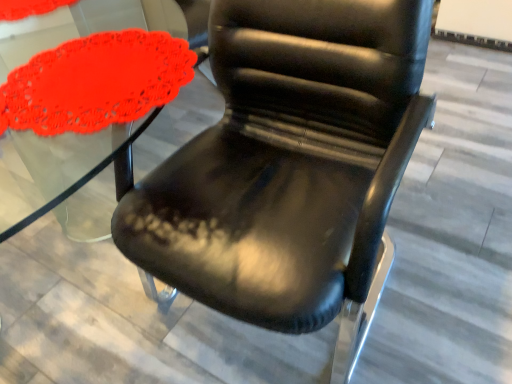
Question: Considering the positions of black leather chair at center and matte red doily at left in the image, is black leather chair at center wider or thinner than matte red doily at left?

Choices:
 (A) wide
 (B) thin

Answer: (A)

Question: From a real-world perspective, is black leather chair at center positioned above or below matte red doily at left?

Choices:
 (A) above
 (B) below

Answer: (B)

Question: Is black leather chair at center inside the boundaries of matte red doily at left, or outside?

Choices:
 (A) outside
 (B) inside

Answer: (A)

Question: Is matte red doily at left in front of or behind black leather chair at center in the image?

Choices:
 (A) behind
 (B) front

Answer: (A)

Question: From their relative heights in the image, would you say matte red doily at left is taller or shorter than black leather chair at center?

Choices:
 (A) tall
 (B) short

Answer: (B)

Question: From the image's perspective, is matte red doily at left positioned above or below black leather chair at center?

Choices:
 (A) below
 (B) above

Answer: (B)

Question: Would you say matte red doily at left is inside or outside black leather chair at center?

Choices:
 (A) inside
 (B) outside

Answer: (A)